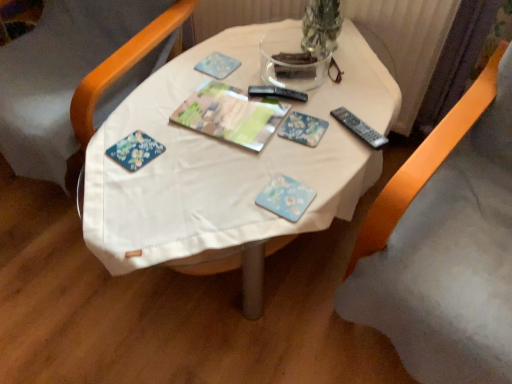
Locate an element on the screen. The height and width of the screenshot is (384, 512). free area behind floral-patterned paper at center-left is located at coordinates (151, 111).